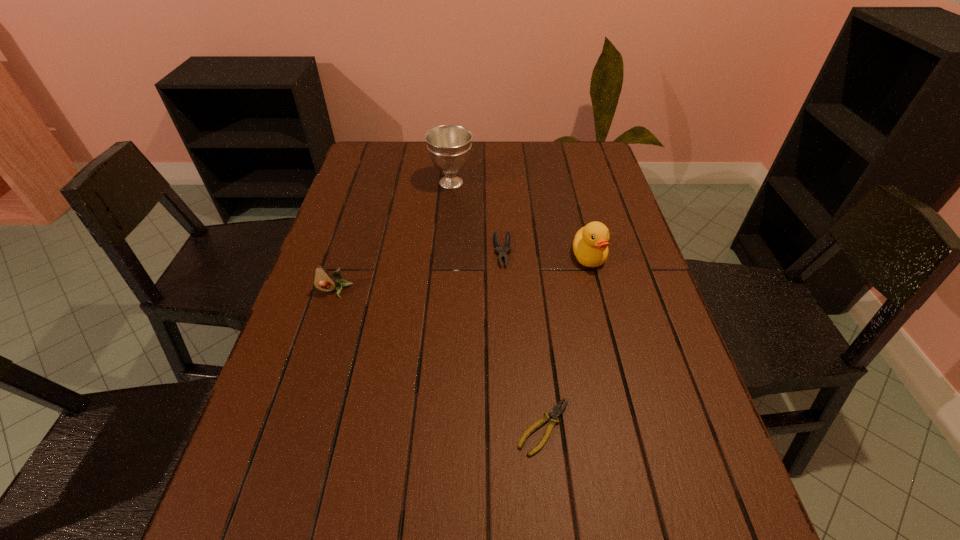
Locate an element on the screen. Image resolution: width=960 pixels, height=540 pixels. vacant space that satisfies the following two spatial constraints: 1. on the seed side of the nearest object; 2. on the left side of the third shortest object is located at coordinates (292, 427).

Where is `free point that satisfies the following two spatial constraints: 1. on the seed side of the shortest object; 2. on the right side of the fourth farthest object`? Image resolution: width=960 pixels, height=540 pixels. free point that satisfies the following two spatial constraints: 1. on the seed side of the shortest object; 2. on the right side of the fourth farthest object is located at coordinates (292, 427).